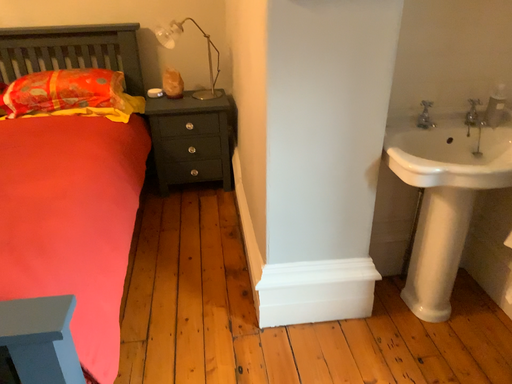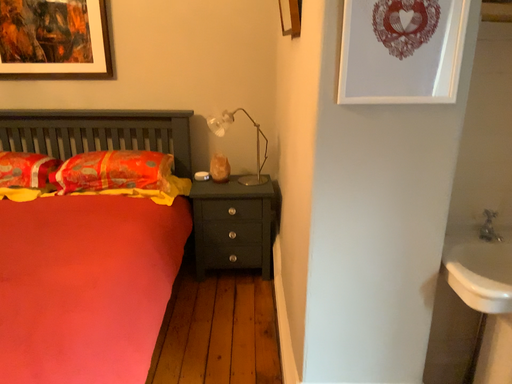
Question: How did the camera likely rotate when shooting the video?

Choices:
 (A) rotated downward
 (B) rotated upward

Answer: (B)